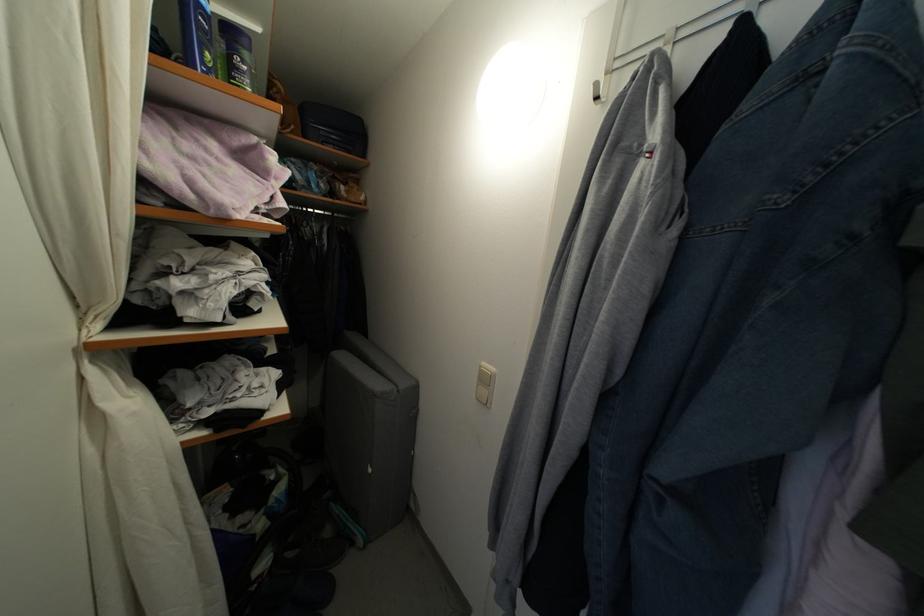
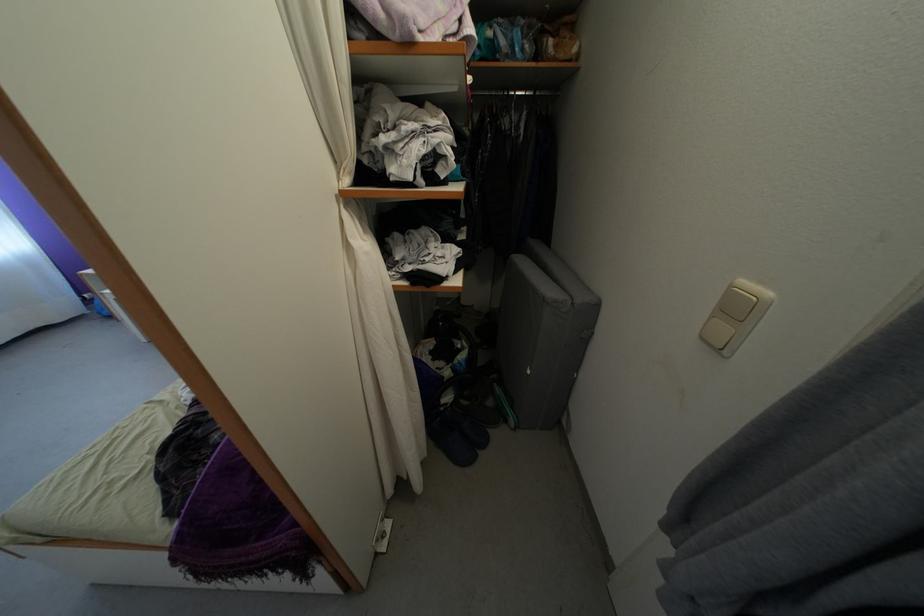
Find the pixel in the second image that matches point (483, 391) in the first image.

(718, 323)